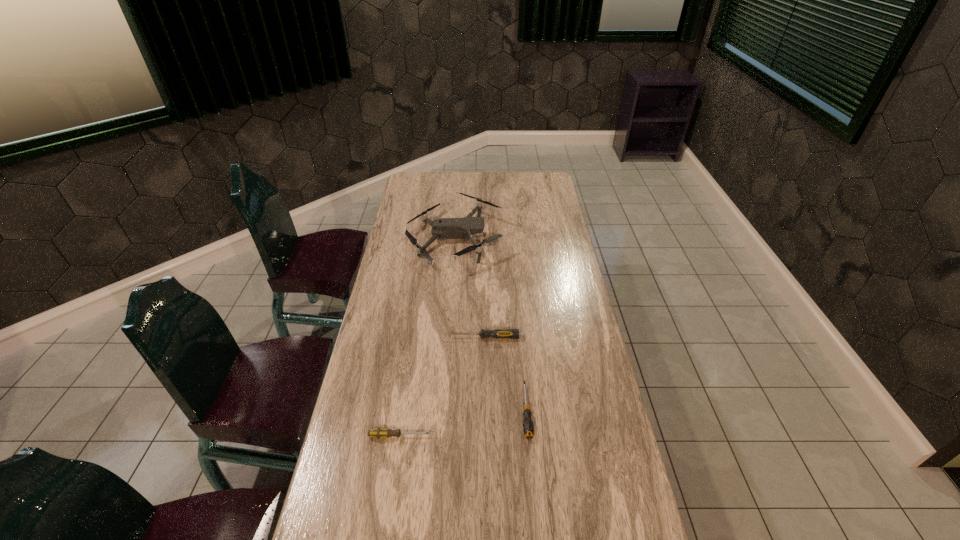
Find the location of `the tallest object`. the tallest object is located at coordinates (444, 228).

The width and height of the screenshot is (960, 540). Identify the location of drone. (444, 228).

At what (x,y) coordinates should I click in order to perform the action: click on the second farthest object. Please return your answer as a coordinate pair (x, y). Image resolution: width=960 pixels, height=540 pixels. Looking at the image, I should click on (498, 333).

Find the location of `the leftmost screwdriver`. the leftmost screwdriver is located at coordinates (378, 433).

Locate an element on the screen. The image size is (960, 540). vacant space located 0.160m on the front-facing side of the farthest object is located at coordinates (542, 239).

The image size is (960, 540). I want to click on free space located insert the second farthest object into a screw head, so (x=378, y=338).

Where is `vacant area situated 0.090m insert the second farthest object into a screw head`? The image size is (960, 540). vacant area situated 0.090m insert the second farthest object into a screw head is located at coordinates (420, 338).

Identify the location of vacant region located insert the second farthest object into a screw head. (369, 338).

Locate an element on the screen. vacant space located 0.140m at the tip of the leftmost screwdriver is located at coordinates (483, 436).

You are a GUI agent. You are given a task and a screenshot of the screen. Output one action in this format:
    pyautogui.click(x=<x>, y=<y>)
    Task: Click on the drone present at the left edge
    
    Given the screenshot: What is the action you would take?
    pyautogui.click(x=444, y=228)